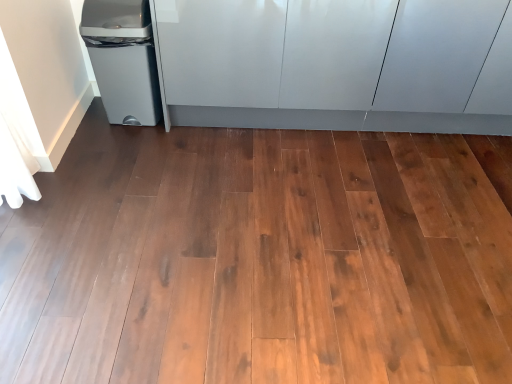
Question: Considering the positions of point (421, 122) and point (139, 52), is point (421, 122) closer or farther from the camera than point (139, 52)?

Choices:
 (A) closer
 (B) farther

Answer: (B)

Question: Considering the relative positions of glossy white cabinetry at upper center and matte gray plastic trash can at left in the image provided, is glossy white cabinetry at upper center to the left or to the right of matte gray plastic trash can at left?

Choices:
 (A) right
 (B) left

Answer: (A)

Question: Which is farther from the white fabric curtain at left?

Choices:
 (A) glossy white cabinetry at upper center
 (B) matte gray plastic trash can at left

Answer: (A)

Question: Estimate the real-world distances between objects in this image. Which object is farther from the glossy white cabinetry at upper center?

Choices:
 (A) matte gray plastic trash can at left
 (B) white fabric curtain at left

Answer: (B)